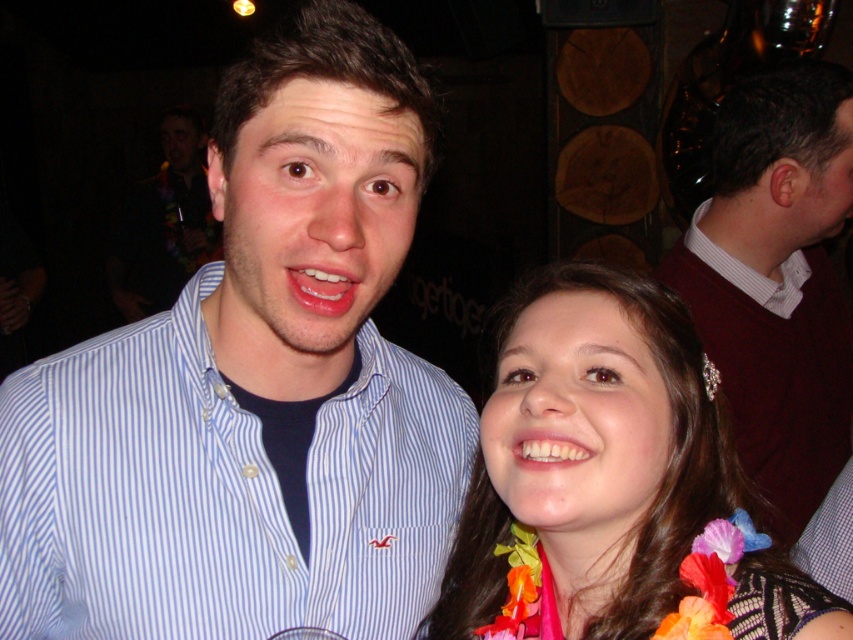
Question: Among these objects, which one is farthest from the camera?

Choices:
 (A) floral necklace at center
 (B) white glossy teeth at center
 (C) white striped shirt at upper right
 (D) glossy pink lips at center

Answer: (C)

Question: Estimate the real-world distances between objects in this image. Which object is closer to the maroon sweater at right?

Choices:
 (A) white striped shirt at upper right
 (B) blue striped shirt at center
 (C) matte blue shirt at center
 (D) floral necklace at center

Answer: (A)

Question: Considering the relative positions of maroon sweater at right and matte blue shirt at center in the image provided, where is maroon sweater at right located with respect to matte blue shirt at center?

Choices:
 (A) left
 (B) right

Answer: (B)

Question: Is blue striped shirt at center positioned at the back of maroon sweater at right?

Choices:
 (A) no
 (B) yes

Answer: (A)

Question: Which point is closer to the camera?

Choices:
 (A) (334, 304)
 (B) (357, 435)
 (C) (814, 163)

Answer: (A)

Question: Does maroon sweater at right appear under white striped shirt at upper right?

Choices:
 (A) yes
 (B) no

Answer: (A)